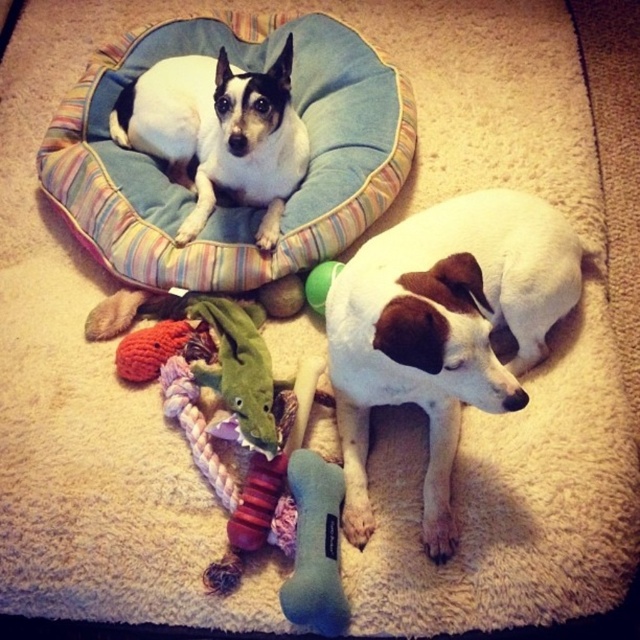
Question: Does blue fabric dog bed at upper left have a lesser width compared to white soft fur dog at lower center?

Choices:
 (A) no
 (B) yes

Answer: (A)

Question: Among these objects, which one is nearest to the camera?

Choices:
 (A) white soft fur dog at lower center
 (B) white soft dog at upper left

Answer: (A)

Question: Can you confirm if blue fabric dog bed at upper left is positioned to the right of white soft fur dog at lower center?

Choices:
 (A) no
 (B) yes

Answer: (A)

Question: Which point appears farthest from the camera in this image?

Choices:
 (A) (184, 124)
 (B) (308, 280)
 (C) (160, 208)
 (D) (452, 298)

Answer: (A)

Question: Which point is farther from the camera taking this photo?

Choices:
 (A) (548, 285)
 (B) (324, 273)
 (C) (241, 60)

Answer: (C)

Question: Does white soft dog at upper left appear on the left side of green rubber ball at center?

Choices:
 (A) yes
 (B) no

Answer: (A)